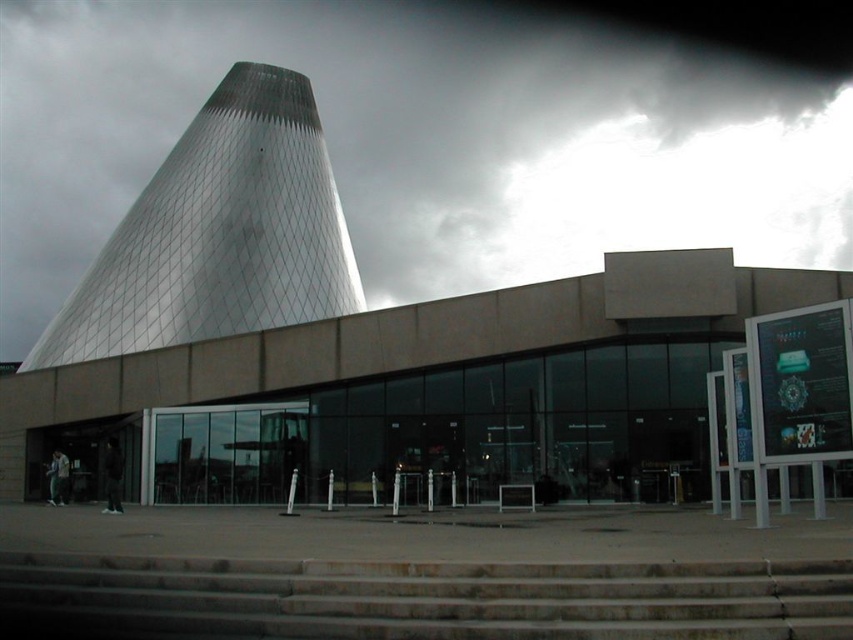
Is dark gray textured cone at upper center thinner than concrete stairs at center?

Incorrect, dark gray textured cone at upper center's width is not less than concrete stairs at center's.

Where is `dark gray textured cone at upper center`? The image size is (853, 640). dark gray textured cone at upper center is located at coordinates (439, 132).

Locate an element on the screen. dark gray textured cone at upper center is located at coordinates (439, 132).

Can you confirm if concrete stairs at center is positioned to the left of metallic glass tower at upper left?

No, concrete stairs at center is not to the left of metallic glass tower at upper left.

At what (x,y) coordinates should I click in order to perform the action: click on concrete stairs at center. Please return your answer as a coordinate pair (x, y). The height and width of the screenshot is (640, 853). Looking at the image, I should click on (434, 596).

Which is behind, point (556, 637) or point (93, 310)?

The point (93, 310) is more distant.

The width and height of the screenshot is (853, 640). Find the location of `concrete stairs at center`. concrete stairs at center is located at coordinates (434, 596).

Does dark gray textured cone at upper center have a greater width compared to metallic glass tower at upper left?

Yes.

Can you confirm if dark gray textured cone at upper center is positioned above metallic glass tower at upper left?

Yes, dark gray textured cone at upper center is above metallic glass tower at upper left.

Find the location of `dark gray textured cone at upper center`. dark gray textured cone at upper center is located at coordinates (439, 132).

Locate an element on the screen. The height and width of the screenshot is (640, 853). dark gray textured cone at upper center is located at coordinates (439, 132).